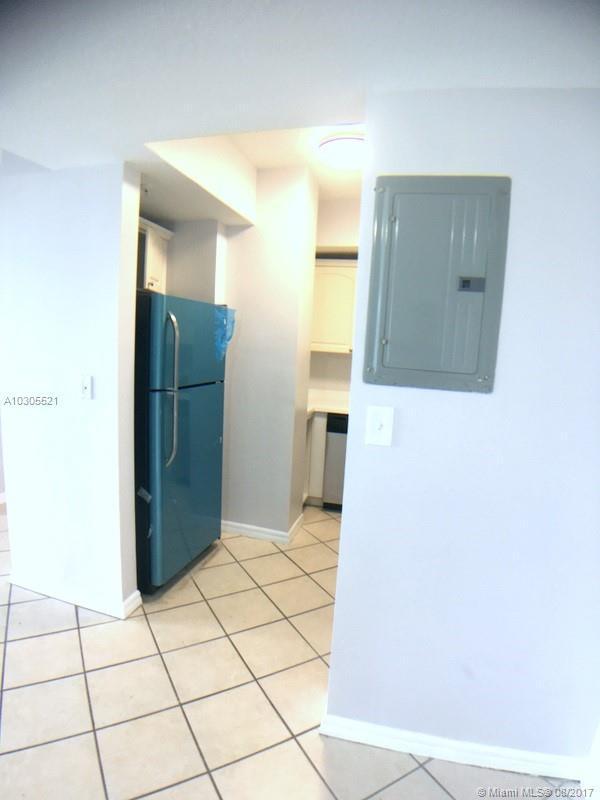
Identify the location of light switch. The width and height of the screenshot is (600, 800). (84, 386), (382, 428).